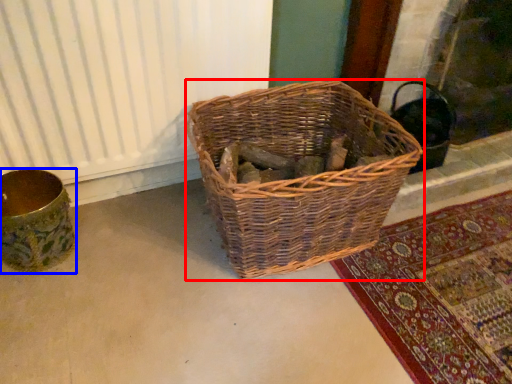
Question: Which point is closer to the camera, picnic basket (highlighted by a red box) or flower basket (highlighted by a blue box)?

Choices:
 (A) picnic basket
 (B) flower basket

Answer: (A)